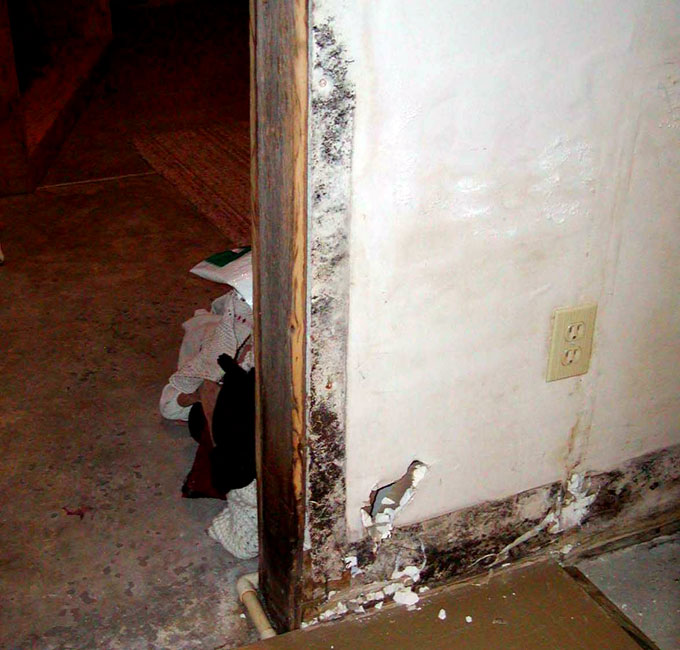
In order to click on chunks of drywall in this screenshot , I will do `click(405, 600)`, `click(439, 616)`, `click(466, 619)`, `click(379, 592)`.